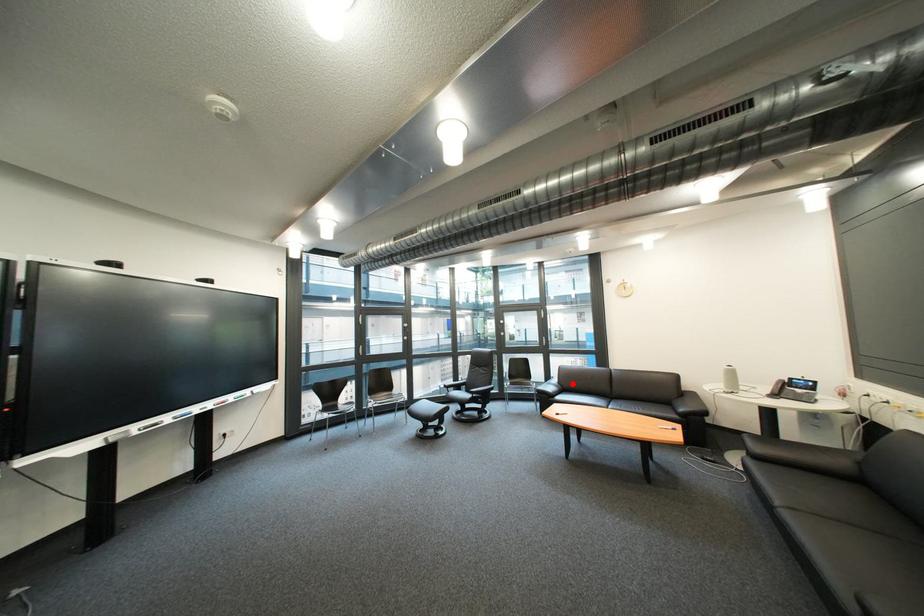
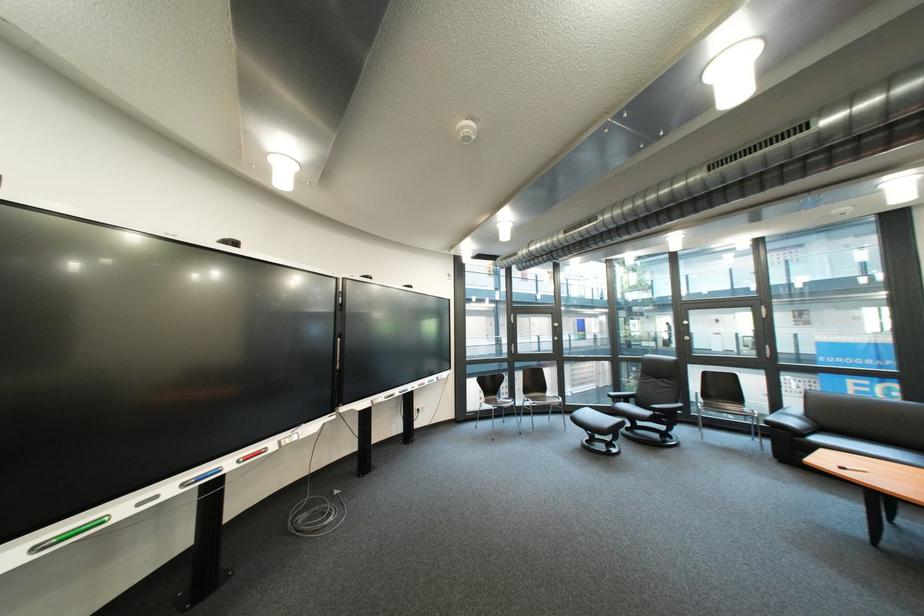
Question: I am providing you with two images of the same scene from different viewpoints. Given a red point in image1, look at the same physical point in image2. Is it:

Choices:
 (A) Closer to the viewpoint
 (B) Farther from the viewpoint

Answer: (A)